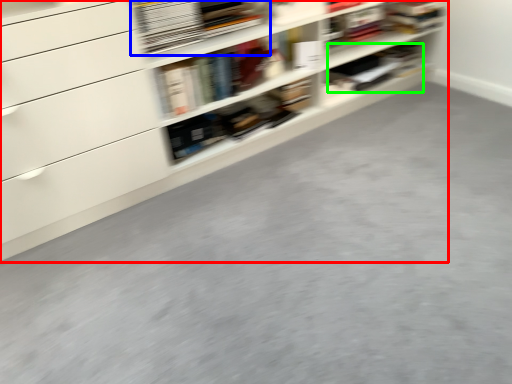
Question: Which object is the farthest from shelf (highlighted by a red box)? Choose among these: book (highlighted by a blue box) or book (highlighted by a green box).

Choices:
 (A) book
 (B) book

Answer: (B)